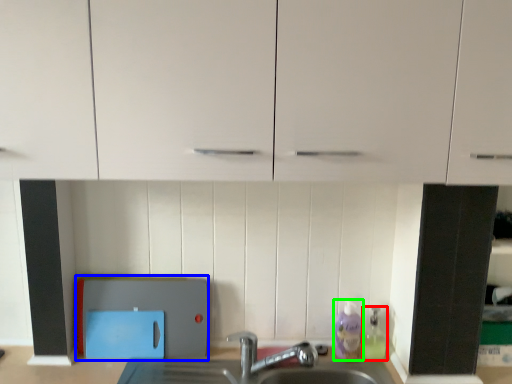
Question: Considering the real-world distances, which object is farthest from cleaning product (highlighted by a red box)? appliance (highlighted by a blue box) or cleaning product (highlighted by a green box)?

Choices:
 (A) appliance
 (B) cleaning product

Answer: (A)